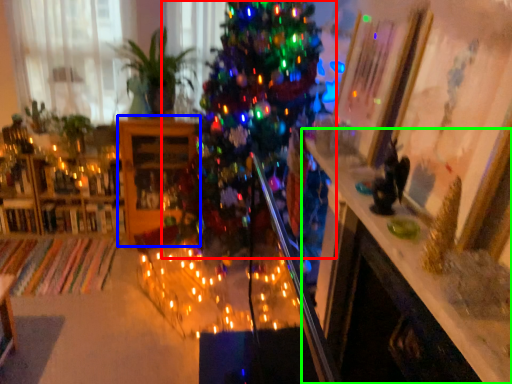
Question: Which is farther away from christmas tree (highlighted by a red box)? shelf (highlighted by a blue box) or table (highlighted by a green box)?

Choices:
 (A) shelf
 (B) table

Answer: (B)